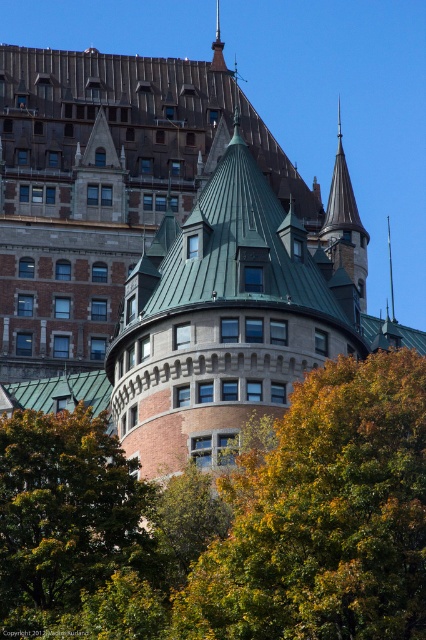
Question: Based on their relative distances, which object is farther from the smooth gray stone tower at upper right?

Choices:
 (A) brown stone tower at center
 (B) green leafy tree at lower left

Answer: (B)

Question: Based on their relative distances, which object is nearer to the smooth gray stone tower at upper right?

Choices:
 (A) brown stone tower at center
 (B) green leafy tree at lower left
 (C) green leafy tree at center

Answer: (A)

Question: Does brown stone tower at center appear on the right side of smooth gray stone tower at upper right?

Choices:
 (A) no
 (B) yes

Answer: (A)

Question: Among these objects, which one is farthest from the camera?

Choices:
 (A) smooth gray stone tower at upper right
 (B) green leafy tree at lower left
 (C) green leafy tree at center
 (D) brown stone tower at center

Answer: (A)

Question: Does green leafy tree at lower left appear on the right side of smooth gray stone tower at upper right?

Choices:
 (A) yes
 (B) no

Answer: (B)

Question: Does green leafy tree at center come behind brown stone tower at center?

Choices:
 (A) yes
 (B) no

Answer: (B)